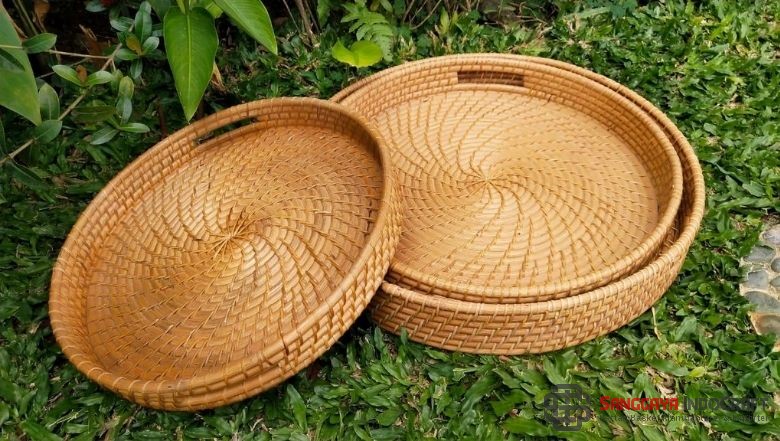
The height and width of the screenshot is (441, 780). I want to click on larger basket with a small basket inside it, so click(x=571, y=320).